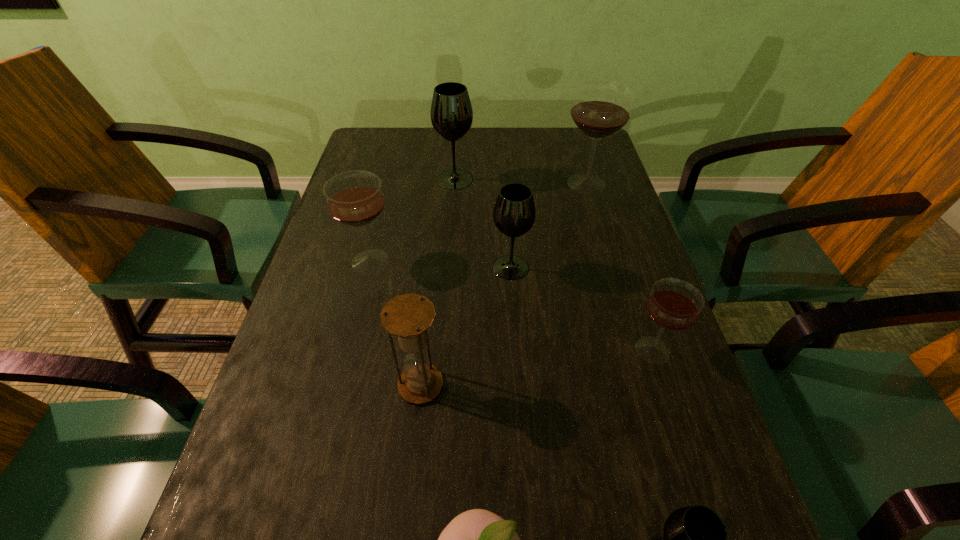
The height and width of the screenshot is (540, 960). In order to click on the leftmost gray wineglass in this screenshot , I will do `click(451, 114)`.

Find the location of a particular element. The image size is (960, 540). the biggest gray wineglass is located at coordinates (451, 114).

I want to click on the biggest red wineglass, so click(x=601, y=108).

Find the location of a particular element. This screenshot has height=540, width=960. the leftmost object is located at coordinates (354, 198).

You are a GUI agent. You are given a task and a screenshot of the screen. Output one action in this format:
    pyautogui.click(x=<x>, y=<y>)
    Task: Click on the second smallest red wineglass
    The image size is (960, 540).
    Given the screenshot: What is the action you would take?
    pyautogui.click(x=354, y=198)

At what (x,y) coordinates should I click in order to perform the action: click on the fourth wineglass from right to left. Please return your answer as a coordinate pair (x, y). The height and width of the screenshot is (540, 960). Looking at the image, I should click on (514, 213).

Find the location of a particular element. The height and width of the screenshot is (540, 960). the second biggest gray wineglass is located at coordinates (514, 213).

Image resolution: width=960 pixels, height=540 pixels. I want to click on brown hourglass, so click(408, 316).

Identify the location of the smallest red wineglass. The width and height of the screenshot is (960, 540). (673, 304).

Identify the location of the second nearest wineglass. The width and height of the screenshot is (960, 540). (673, 304).